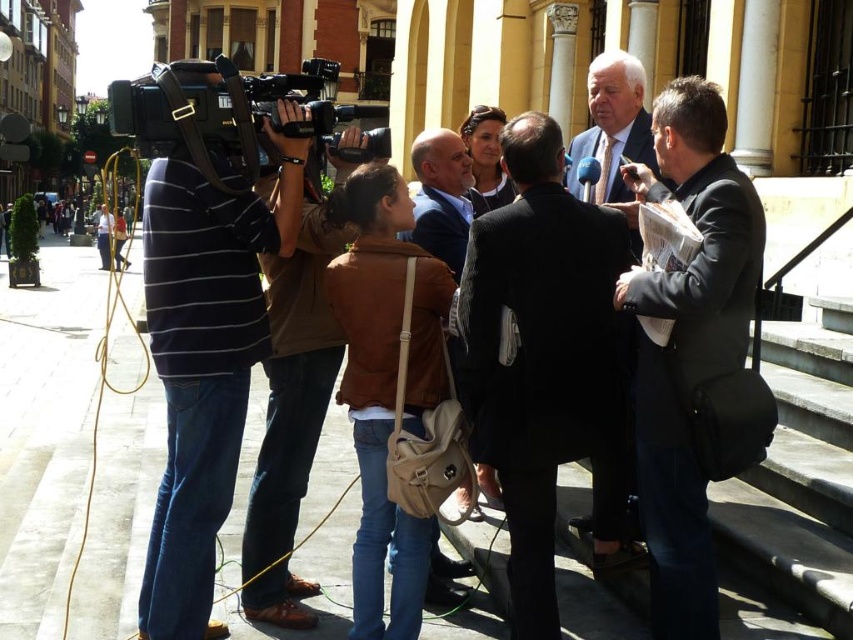
Is gray concrete stairs at lower right thinner than brown leather jacket at center?

No.

Where is `gray concrete stairs at lower right`? The height and width of the screenshot is (640, 853). gray concrete stairs at lower right is located at coordinates (799, 472).

Between black suit at center and light brown leather jacket at center, which one is positioned lower?

Positioned lower is black suit at center.

Does point (619, 228) come farther from viewer compared to point (585, 129)?

No, it is not.

Locate an element on the screen. This screenshot has width=853, height=640. black suit at center is located at coordinates (547, 364).

Measure the distance from matte black camera at left to gray concrete stairs at lower right.

matte black camera at left and gray concrete stairs at lower right are 49.63 feet apart.

Does point (194, 566) lie behind point (790, 413)?

No, it is not.

Between point (207, 580) and point (842, 333), which one is positioned in front?

Positioned in front is point (207, 580).

Where is `matte black camera at left`? Image resolution: width=853 pixels, height=640 pixels. matte black camera at left is located at coordinates (204, 358).